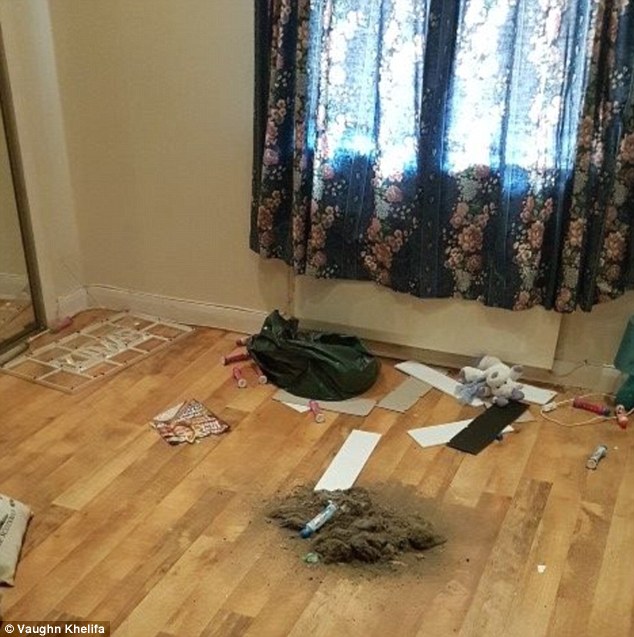
I want to click on cord, so click(548, 406).